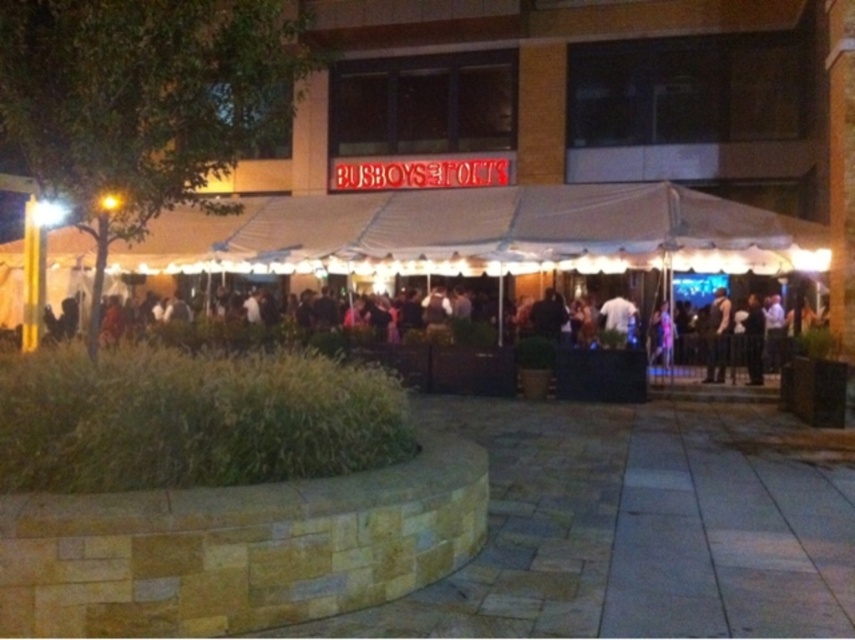
Question: Can you confirm if black fabric tent at center is thinner than dark brown leather jacket at center?

Choices:
 (A) yes
 (B) no

Answer: (B)

Question: Is white tent at center to the left of black fabric tent at center from the viewer's perspective?

Choices:
 (A) yes
 (B) no

Answer: (B)

Question: Based on their relative distances, which object is farther from the black fabric tent at center?

Choices:
 (A) white tent at center
 (B) dark brown leather jacket at center

Answer: (B)

Question: Is black fabric tent at center below dark brown leather jacket at center?

Choices:
 (A) yes
 (B) no

Answer: (B)

Question: Which of the following is the closest to the observer?

Choices:
 (A) white tent at center
 (B) black fabric tent at center

Answer: (B)

Question: Estimate the real-world distances between objects in this image. Which object is closer to the dark brown leather jacket at center?

Choices:
 (A) white tent at center
 (B) black fabric tent at center

Answer: (B)